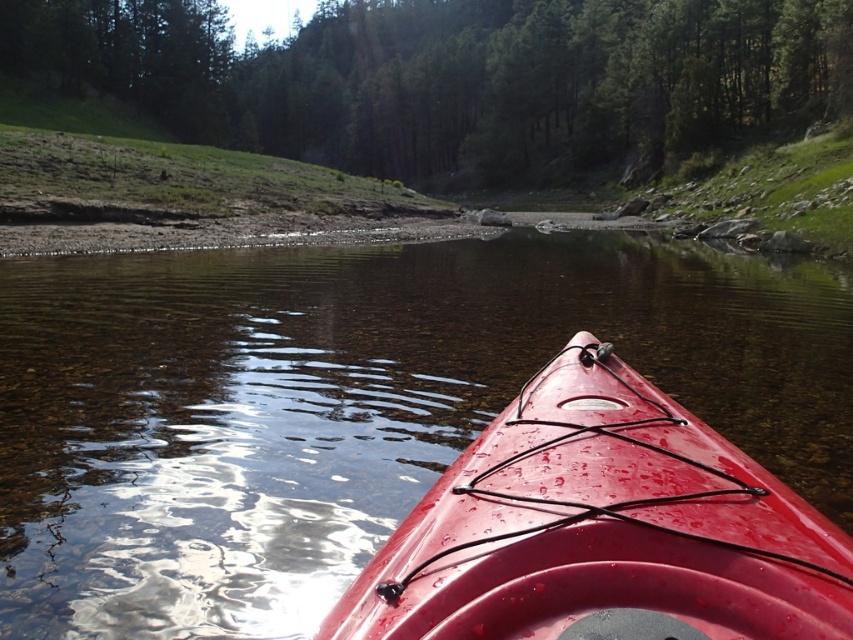
You are navigating a transparent plastic kayak at center in a serene water environment. Your destination is a point located at coordinate 0.634, 0.410. Can you reach it directly from your current position?

The transparent plastic kayak at center is already positioned at point (349,404), so you are already at the destination.

You are in a red kayak and want to check if the transparent plastic kayak at center is above the glossy plastic kayak at center. Can you confirm this based on your current view?

The transparent plastic kayak at center is positioned over the glossy plastic kayak at center, so yes, the transparent plastic kayak at center is above the glossy plastic kayak at center in your current view.

In the scene shown: You are a kayaker planning to choose between the transparent plastic kayak at center and the glossy plastic kayak at center. Considering their sizes, which one would you recommend for a solo trip requiring more storage space?

The transparent plastic kayak at center is bigger than the glossy plastic kayak at center, so it would provide more storage space for a solo trip.